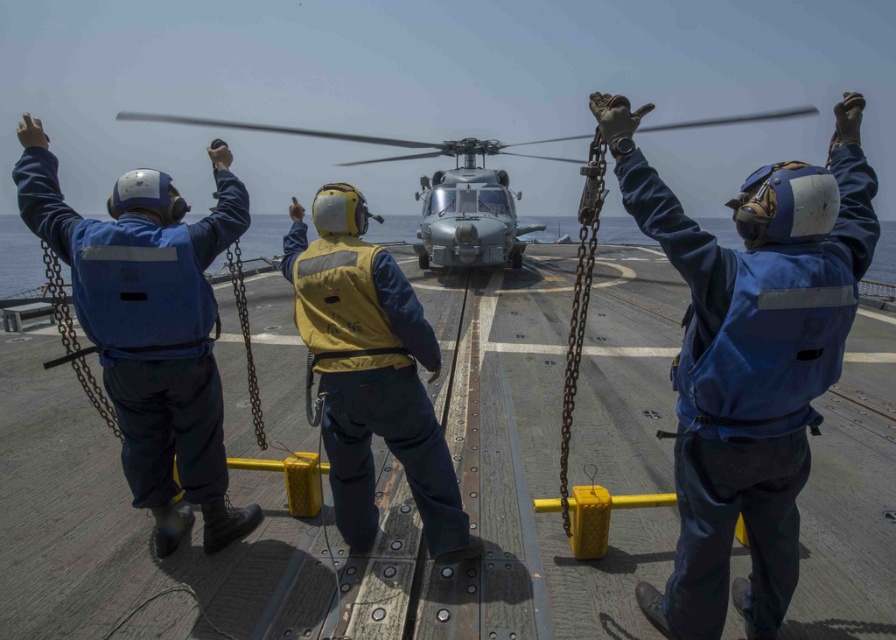
Question: Which of the following is the closest to the observer?

Choices:
 (A) (383, 376)
 (B) (222, 188)
 (C) (579, 163)
 (D) (872, 170)

Answer: (D)

Question: Is blue fabric helmet at upper center positioned behind yellow reflective vest at center?

Choices:
 (A) no
 (B) yes

Answer: (A)

Question: Is blue fabric helmet at upper left below metallic gray helicopter at center?

Choices:
 (A) no
 (B) yes

Answer: (B)

Question: Which of the following is the farthest from the observer?

Choices:
 (A) (168, 193)
 (B) (121, 113)
 (C) (745, 465)

Answer: (B)

Question: Is blue fabric helmet at upper center positioned behind metallic gray helicopter at center?

Choices:
 (A) no
 (B) yes

Answer: (A)

Question: Which point is farther to the camera?

Choices:
 (A) blue fabric helmet at upper left
 (B) blue fabric helmet at upper center
 (C) metallic gray helicopter at center
 (D) yellow reflective vest at center

Answer: (C)